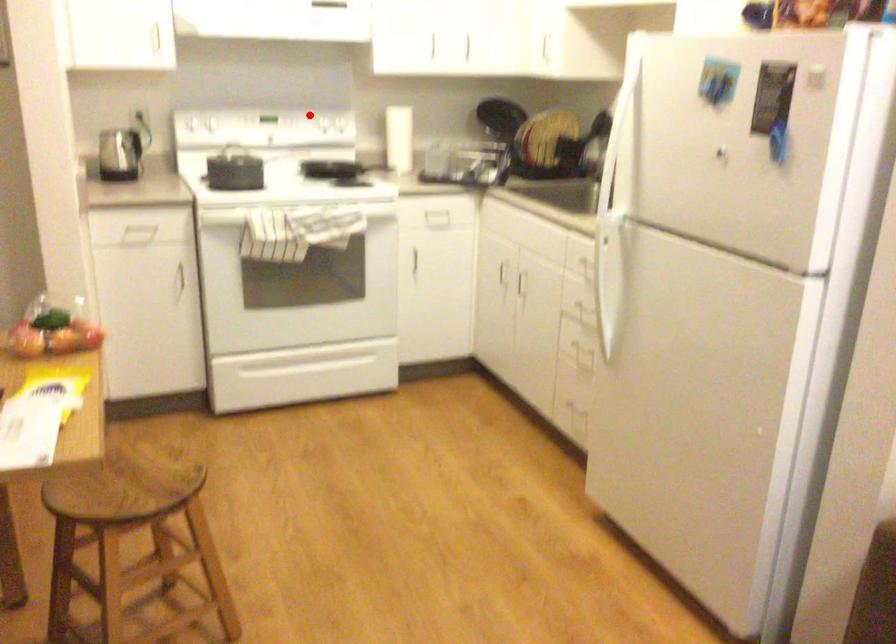
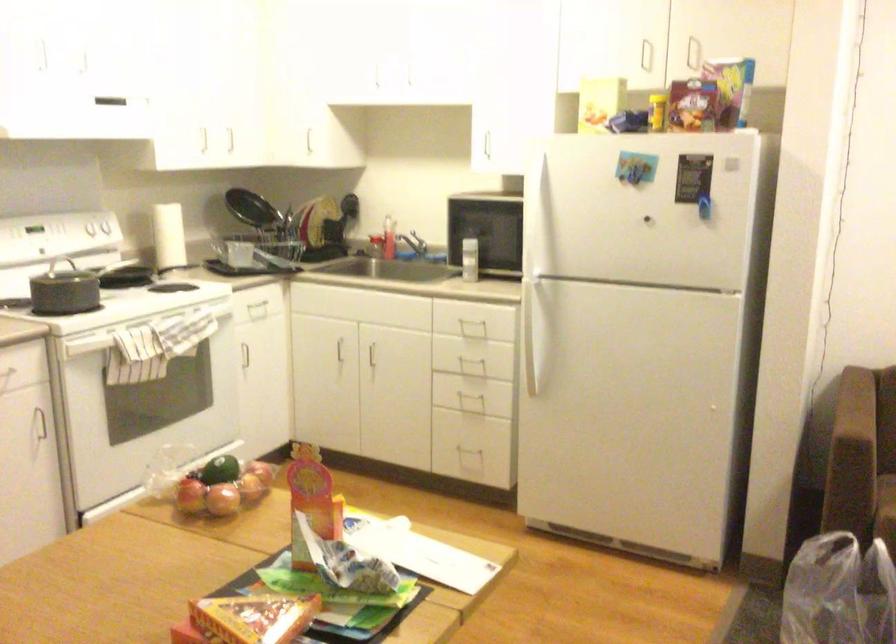
The point at the highlighted location is marked in the first image. Where is the corresponding point in the second image?

(98, 232)